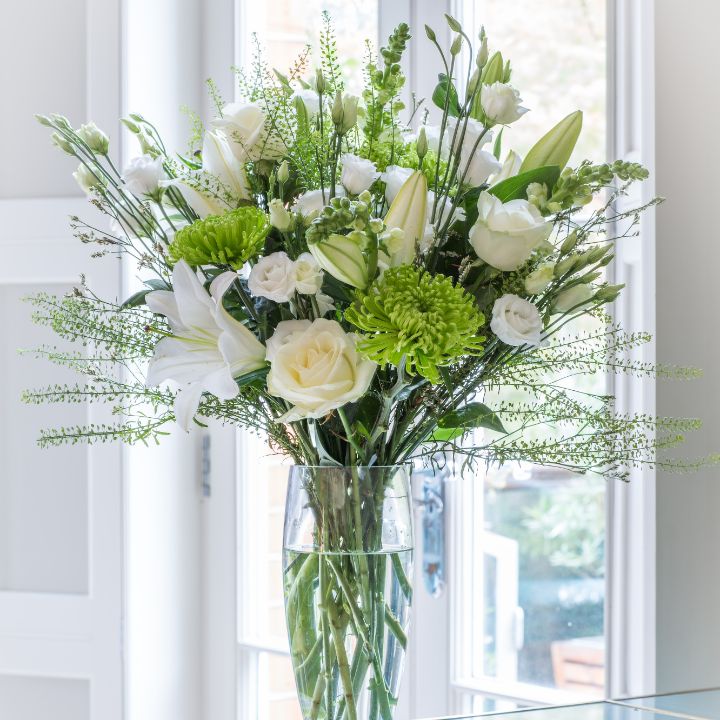
What are the coordinates of `vase` in the screenshot? It's located at (345, 558).